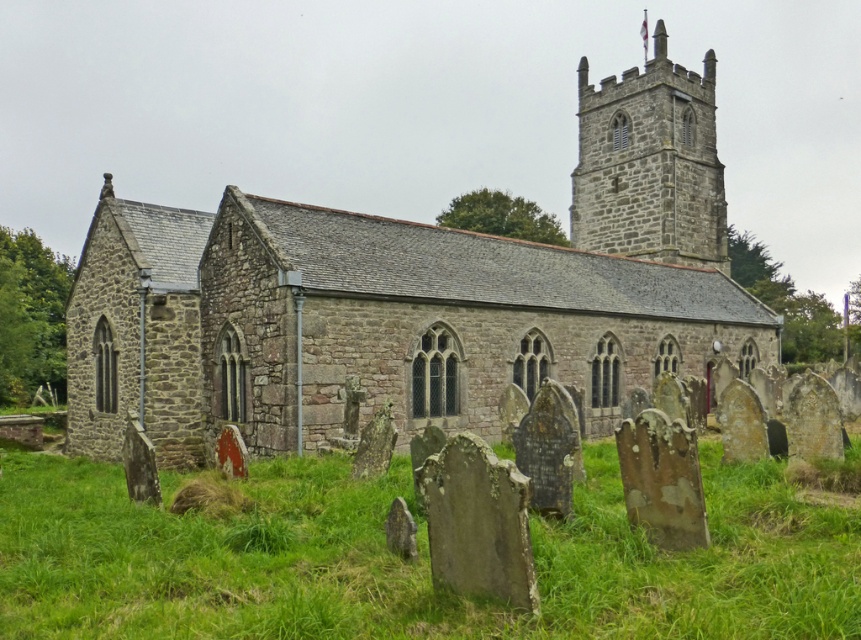
Is stone church at center positioned at the back of gray stone tower at upper center?

No, stone church at center is closer to the viewer.

Measure the distance between stone church at center and gray stone tower at upper center.

A distance of 9.88 meters exists between stone church at center and gray stone tower at upper center.

At what (x,y) coordinates should I click in order to perform the action: click on stone church at center. Please return your answer as a coordinate pair (x, y). The width and height of the screenshot is (861, 640). Looking at the image, I should click on (414, 296).

Locate an element on the screen. Image resolution: width=861 pixels, height=640 pixels. stone church at center is located at coordinates (414, 296).

Is stone church at center bigger than green mossy grass at lower center?

Yes.

Which is in front, point (404, 404) or point (754, 614)?

Point (754, 614)

Where is `stone church at center`? This screenshot has height=640, width=861. stone church at center is located at coordinates point(414,296).

Does green mossy grass at lower center appear on the right side of gray stone tower at upper center?

In fact, green mossy grass at lower center is to the left of gray stone tower at upper center.

Is the position of green mossy grass at lower center less distant than that of gray stone tower at upper center?

That is True.

Image resolution: width=861 pixels, height=640 pixels. What are the coordinates of `green mossy grass at lower center` in the screenshot? It's located at (406, 561).

You are a GUI agent. You are given a task and a screenshot of the screen. Output one action in this format:
    pyautogui.click(x=<x>, y=<y>)
    Task: Click on the green mossy grass at lower center
    The height and width of the screenshot is (640, 861).
    Given the screenshot: What is the action you would take?
    pyautogui.click(x=406, y=561)